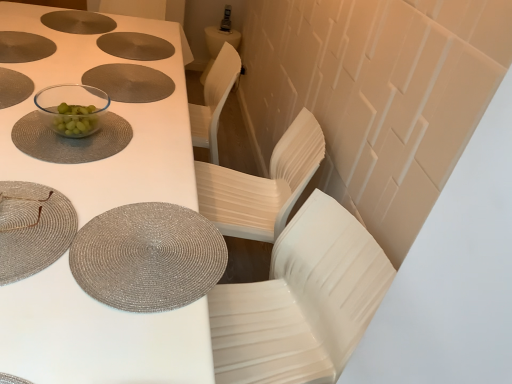
Where is `free space to the back side of silver woven placemat at lower left, arranged as the 2th tableware when ordered from the bottom`? free space to the back side of silver woven placemat at lower left, arranged as the 2th tableware when ordered from the bottom is located at coordinates (75, 159).